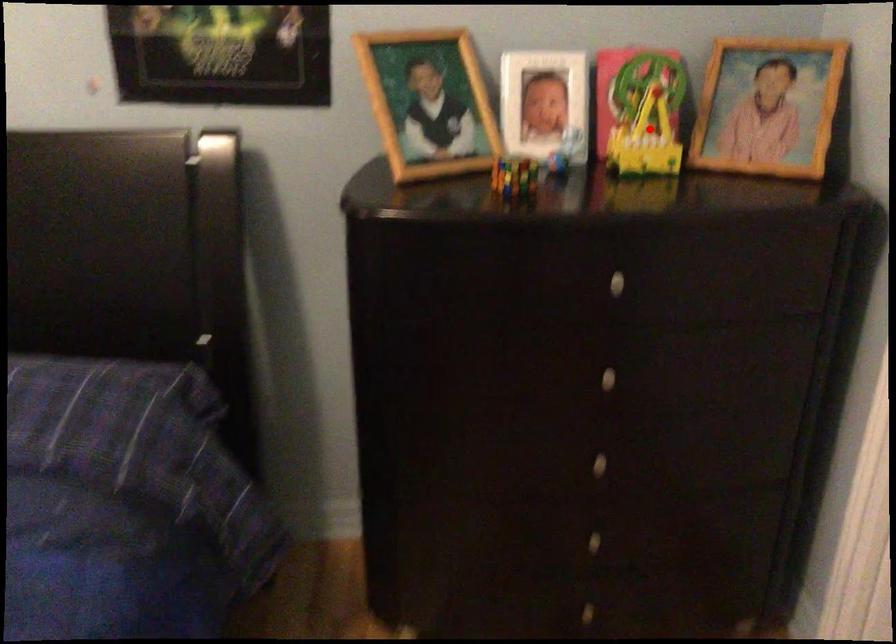
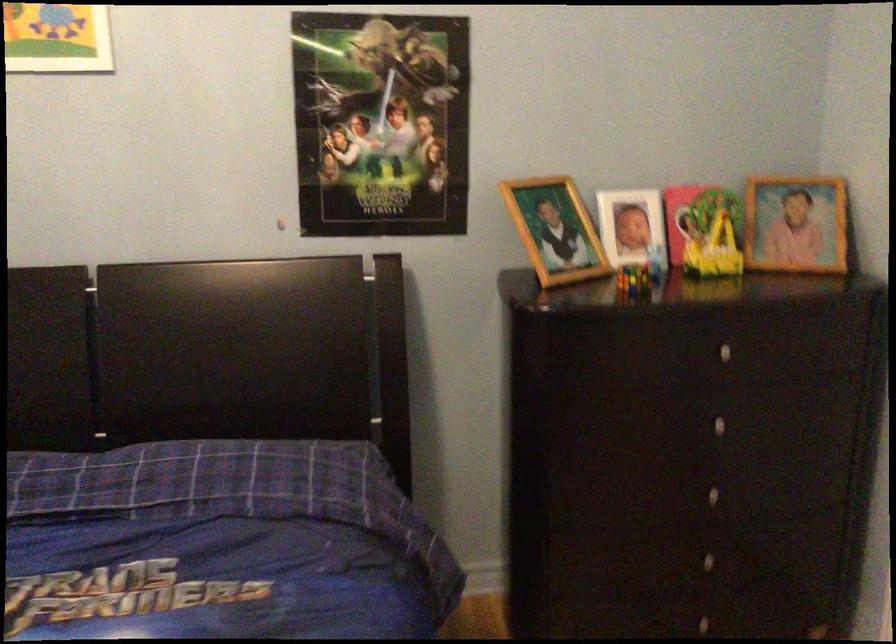
Question: I am providing you with two images of the same scene from different viewpoints. Image1 has a red point marked. In image2, the corresponding 3D location appears at what relative position? Reply with the corresponding letter.

Choices:
 (A) Closer
 (B) Farther

Answer: (B)